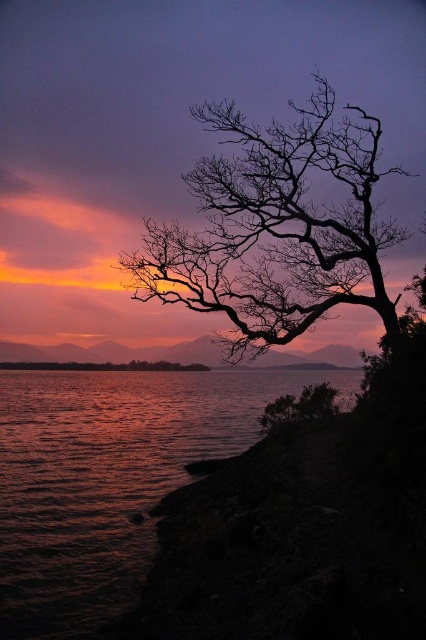
Which is more to the right, shiny metallic water at lower left or silhouette bark tree at upper right?

silhouette bark tree at upper right

From the picture: Does shiny metallic water at lower left appear on the right side of silhouette bark tree at upper right?

No, shiny metallic water at lower left is not to the right of silhouette bark tree at upper right.

What are the coordinates of `shiny metallic water at lower left` in the screenshot? It's located at (108, 477).

Identify the location of shiny metallic water at lower left. (108, 477).